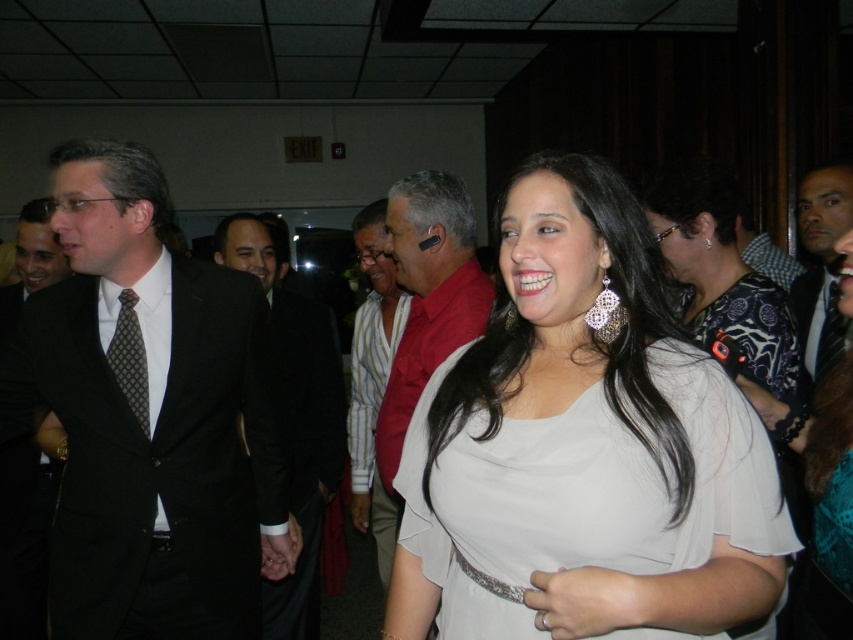
Can you confirm if light beige fabric dress at center is positioned above striped fabric shirt at center?

Correct, light beige fabric dress at center is located above striped fabric shirt at center.

Can you confirm if light beige fabric dress at center is bigger than striped fabric shirt at center?

Actually, light beige fabric dress at center might be smaller than striped fabric shirt at center.

Does point (474, 481) come behind point (357, 410)?

No, (474, 481) is closer to viewer.

Image resolution: width=853 pixels, height=640 pixels. I want to click on light beige fabric dress at center, so click(583, 448).

Who is more distant from viewer, (570, 292) or (416, 397)?

Positioned behind is point (416, 397).

Locate an element on the screen. The height and width of the screenshot is (640, 853). light beige fabric dress at center is located at coordinates (583, 448).

Is point (489, 548) positioned after point (447, 198)?

No, (489, 548) is closer to viewer.

This screenshot has height=640, width=853. In order to click on light beige fabric dress at center in this screenshot , I will do `click(583, 448)`.

Between point (115, 566) and point (125, 317), which one is positioned behind?

The point (125, 317) is more distant.

The image size is (853, 640). What are the coordinates of `black suit at left` in the screenshot? It's located at (149, 417).

This screenshot has width=853, height=640. In order to click on black suit at left in this screenshot , I will do `click(149, 417)`.